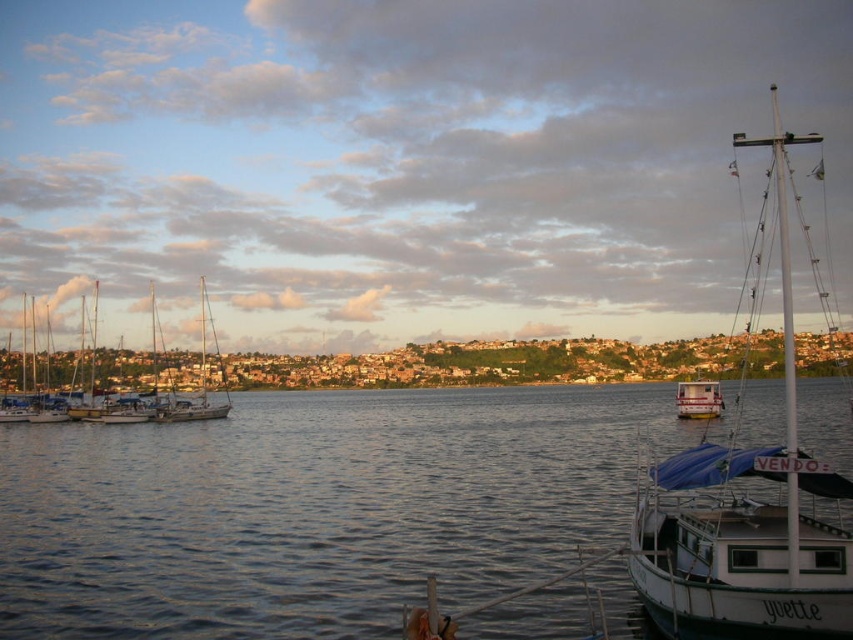
Does white matte sailboat at right appear on the left side of white sailboat at left?

No, white matte sailboat at right is not to the left of white sailboat at left.

Measure the distance from white matte sailboat at right to white sailboat at left.

128.26 meters

Where is `white matte sailboat at right`? Image resolution: width=853 pixels, height=640 pixels. white matte sailboat at right is located at coordinates [x=746, y=508].

Who is higher up, clear water at center or white matte boat at right?

white matte boat at right

Is point (456, 481) more distant than point (688, 396)?

No, it is in front of (688, 396).

Does point (175, 461) lie in front of point (695, 403)?

That is True.

Where is `clear water at center`? Image resolution: width=853 pixels, height=640 pixels. clear water at center is located at coordinates (314, 509).

From the picture: Between clear water at center and white sailboat at left, which one has less height?

clear water at center

Can you confirm if clear water at center is positioned below white sailboat at left?

Yes, clear water at center is below white sailboat at left.

Find the location of a particular element. This screenshot has width=853, height=640. clear water at center is located at coordinates (314, 509).

Find the location of `clear water at center`. clear water at center is located at coordinates (314, 509).